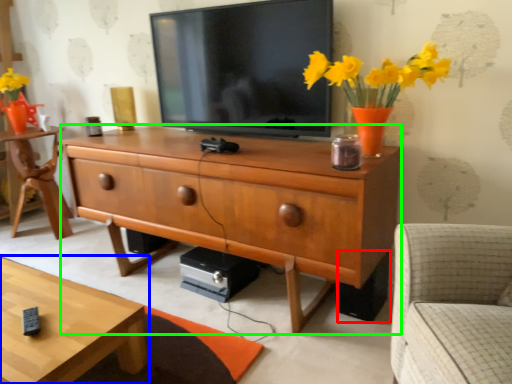
Question: Based on their relative distances, which object is nearer to speaker (highlighted by a red box)? Choose from coffee table (highlighted by a blue box) and chest of drawers (highlighted by a green box).

Choices:
 (A) coffee table
 (B) chest of drawers

Answer: (B)